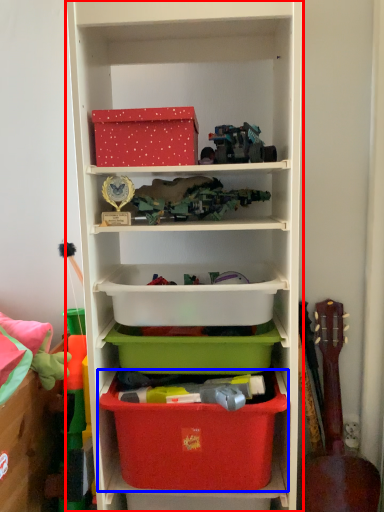
Question: Which object is further to the camera taking this photo, shelf (highlighted by a red box) or storage box (highlighted by a blue box)?

Choices:
 (A) shelf
 (B) storage box

Answer: (B)